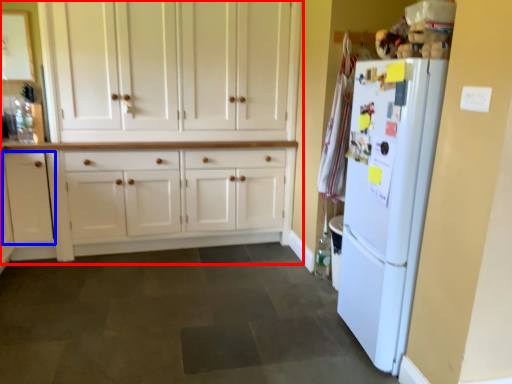
Question: Among these objects, which one is nearest to the camera, cabinetry (highlighted by a red box) or cabinetry (highlighted by a blue box)?

Choices:
 (A) cabinetry
 (B) cabinetry

Answer: (A)